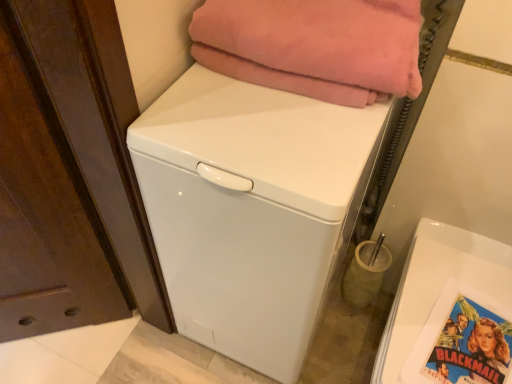
Question: Is pink fleece blanket at upper center not inside white glossy washing machine at center?

Choices:
 (A) yes
 (B) no

Answer: (A)

Question: Is pink fleece blanket at upper center closer to camera compared to white glossy washing machine at center?

Choices:
 (A) yes
 (B) no

Answer: (B)

Question: Considering the relative sizes of pink fleece blanket at upper center and white glossy washing machine at center in the image provided, is pink fleece blanket at upper center wider than white glossy washing machine at center?

Choices:
 (A) no
 (B) yes

Answer: (A)

Question: From the image's perspective, is pink fleece blanket at upper center below white glossy washing machine at center?

Choices:
 (A) yes
 (B) no

Answer: (B)

Question: Is pink fleece blanket at upper center positioned far away from white glossy washing machine at center?

Choices:
 (A) no
 (B) yes

Answer: (A)

Question: Is pink fleece blanket at upper center at the right side of white glossy washing machine at center?

Choices:
 (A) no
 (B) yes

Answer: (B)

Question: From a real-world perspective, is blue glossy comic book at lower right positioned under white glossy washing machine at center based on gravity?

Choices:
 (A) yes
 (B) no

Answer: (B)

Question: Is blue glossy comic book at lower right oriented towards white glossy washing machine at center?

Choices:
 (A) yes
 (B) no

Answer: (B)

Question: Is blue glossy comic book at lower right to the left of white glossy washing machine at center from the viewer's perspective?

Choices:
 (A) yes
 (B) no

Answer: (B)

Question: Does blue glossy comic book at lower right have a larger size compared to white glossy washing machine at center?

Choices:
 (A) no
 (B) yes

Answer: (A)

Question: From the image's perspective, is blue glossy comic book at lower right located above white glossy washing machine at center?

Choices:
 (A) no
 (B) yes

Answer: (A)

Question: Is blue glossy comic book at lower right looking in the opposite direction of white glossy washing machine at center?

Choices:
 (A) yes
 (B) no

Answer: (B)

Question: Is white glossy washing machine at center located outside pink fleece blanket at upper center?

Choices:
 (A) no
 (B) yes

Answer: (B)